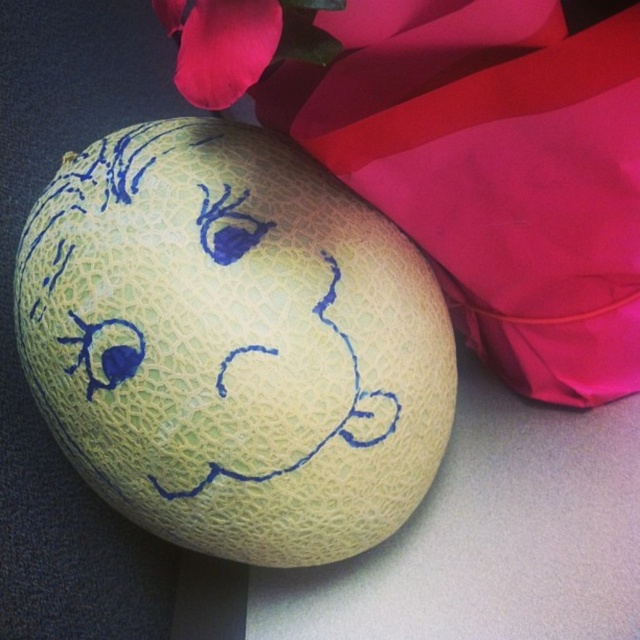
Does green textured cantaloupe at center appear over matte pink petal at upper left?

No.

Who is taller, green textured cantaloupe at center or matte pink petal at upper left?

green textured cantaloupe at center is taller.

Measure the distance between green textured cantaloupe at center and camera.

green textured cantaloupe at center is 1.15 meters from camera.

Locate an element on the screen. The image size is (640, 640). green textured cantaloupe at center is located at coordinates (234, 342).